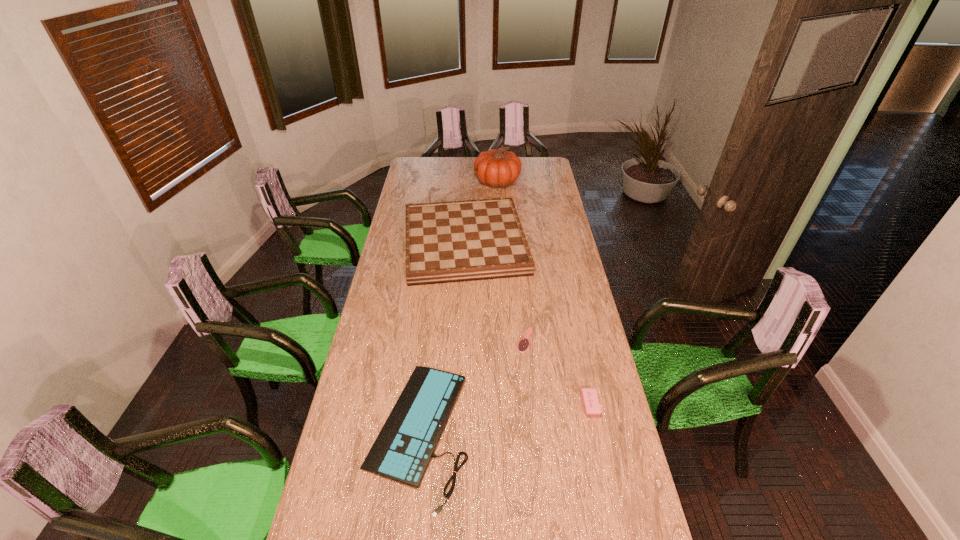
Identify the location of pumpkin. The width and height of the screenshot is (960, 540). (496, 168).

Locate an element on the screen. the tallest object is located at coordinates (496, 168).

Locate an element on the screen. Image resolution: width=960 pixels, height=540 pixels. the fourth shortest object is located at coordinates (457, 241).

Locate an element on the screen. This screenshot has width=960, height=540. the second farthest object is located at coordinates (457, 241).

I want to click on the rightmost object, so click(590, 401).

Identify the location of eraser. (590, 401).

Where is `the fourth tallest object`? the fourth tallest object is located at coordinates (402, 451).

The width and height of the screenshot is (960, 540). In order to click on hairbrush in this screenshot , I will do `click(523, 345)`.

This screenshot has width=960, height=540. I want to click on the shortest object, so click(x=523, y=345).

What are the coordinates of `free spot located 0.150m on the face of the farthest object` in the screenshot? It's located at (449, 181).